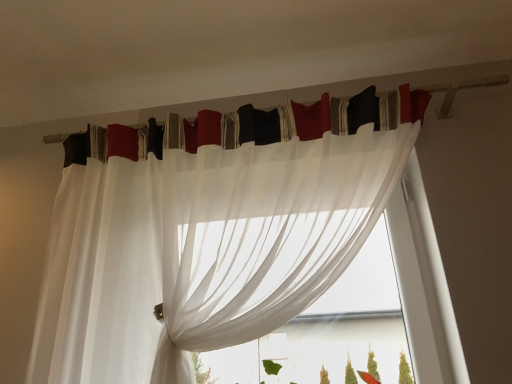
Question: Is sheer white curtain at center next to white sheer curtain at upper center, which is the first curtain in top-to-bottom order, and touching it?

Choices:
 (A) yes
 (B) no

Answer: (B)

Question: Can you confirm if sheer white curtain at center is positioned to the left of white sheer curtain at upper center, the second curtain positioned from the bottom?

Choices:
 (A) yes
 (B) no

Answer: (B)

Question: From a real-world perspective, is sheer white curtain at center positioned under white sheer curtain at upper center, the second curtain positioned from the bottom, based on gravity?

Choices:
 (A) no
 (B) yes

Answer: (B)

Question: Is sheer white curtain at center turned away from white sheer curtain at upper center, the second curtain positioned from the bottom?

Choices:
 (A) yes
 (B) no

Answer: (B)

Question: Considering the relative positions of sheer white curtain at center and white sheer curtain at upper center, which is the first curtain in top-to-bottom order, in the image provided, is sheer white curtain at center in front of white sheer curtain at upper center, which is the first curtain in top-to-bottom order,?

Choices:
 (A) no
 (B) yes

Answer: (B)

Question: Looking at the image, does sheer white curtain at upper center, arranged as the 2th curtain when viewed from the top, seem bigger or smaller compared to sheer white curtain at center?

Choices:
 (A) big
 (B) small

Answer: (A)

Question: Is sheer white curtain at upper center, which appears as the first curtain when ordered from the bottom, wider or thinner than sheer white curtain at center?

Choices:
 (A) wide
 (B) thin

Answer: (B)

Question: Based on their positions, is sheer white curtain at upper center, arranged as the 2th curtain when viewed from the top, located to the left or right of sheer white curtain at center?

Choices:
 (A) right
 (B) left

Answer: (B)

Question: Is sheer white curtain at upper center, which appears as the first curtain when ordered from the bottom, situated inside sheer white curtain at center or outside?

Choices:
 (A) inside
 (B) outside

Answer: (B)

Question: In the image, is sheer white curtain at center positioned in front of or behind white sheer curtain at upper center, the second curtain positioned from the bottom?

Choices:
 (A) behind
 (B) front

Answer: (B)

Question: From the image's perspective, is sheer white curtain at center above or below white sheer curtain at upper center, which is the first curtain in top-to-bottom order?

Choices:
 (A) below
 (B) above

Answer: (A)

Question: In terms of height, does sheer white curtain at center look taller or shorter compared to white sheer curtain at upper center, the second curtain positioned from the bottom?

Choices:
 (A) short
 (B) tall

Answer: (B)

Question: From a real-world perspective, is sheer white curtain at center physically located above or below white sheer curtain at upper center, the second curtain positioned from the bottom?

Choices:
 (A) above
 (B) below

Answer: (B)

Question: Is point (377, 127) closer or farther from the camera than point (200, 129)?

Choices:
 (A) farther
 (B) closer

Answer: (B)

Question: Based on their sizes in the image, would you say white sheer curtain at upper center, the second curtain positioned from the bottom, is bigger or smaller than sheer white curtain at upper center, arranged as the 2th curtain when viewed from the top?

Choices:
 (A) big
 (B) small

Answer: (B)